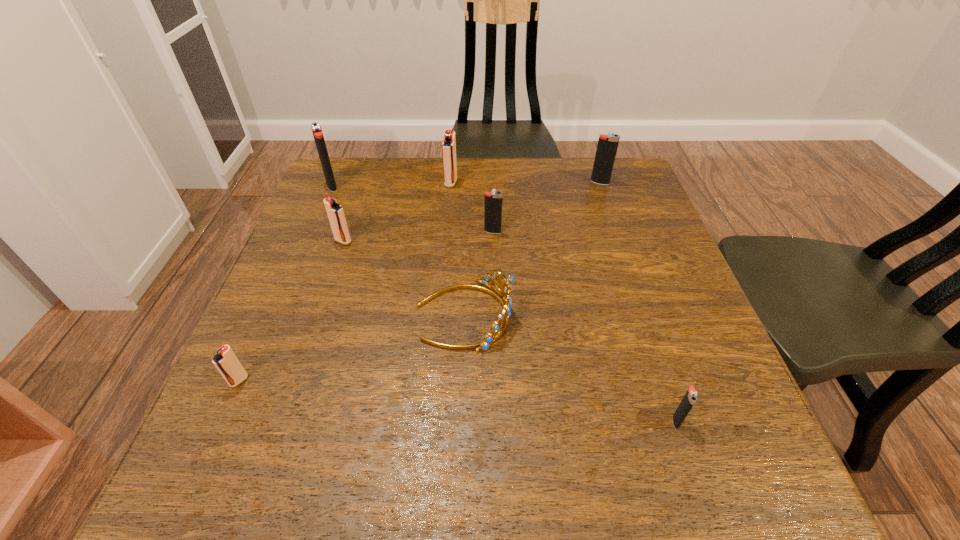
Find the location of a particular element. This screenshot has width=960, height=540. tiara is located at coordinates (505, 300).

You are a GUI agent. You are given a task and a screenshot of the screen. Output one action in this format:
    pyautogui.click(x=<x>, y=<y>)
    Task: Click on the smallest red igniter
    
    Given the screenshot: What is the action you would take?
    pyautogui.click(x=226, y=362)

Where is `the leftmost red igniter`? The width and height of the screenshot is (960, 540). the leftmost red igniter is located at coordinates (226, 362).

This screenshot has width=960, height=540. What are the coordinates of `the nearest black igniter` in the screenshot? It's located at (690, 398).

Identify the location of the smallest black igniter. This screenshot has width=960, height=540. (690, 398).

Where is `free point located on the front of the tallest object`? The height and width of the screenshot is (540, 960). free point located on the front of the tallest object is located at coordinates pyautogui.click(x=314, y=230).

Where is `blank area located 0.250m on the front of the biggest red igniter`? This screenshot has width=960, height=540. blank area located 0.250m on the front of the biggest red igniter is located at coordinates (445, 249).

Find the location of a particular element. vacant space located on the left of the third smallest black igniter is located at coordinates (563, 183).

Locate an element on the screen. Image resolution: width=960 pixels, height=540 pixels. vacant space located 0.160m on the front of the second nearest black igniter is located at coordinates (494, 281).

Locate an element on the screen. vacant space positioned on the front of the fourth nearest object is located at coordinates (x=323, y=302).